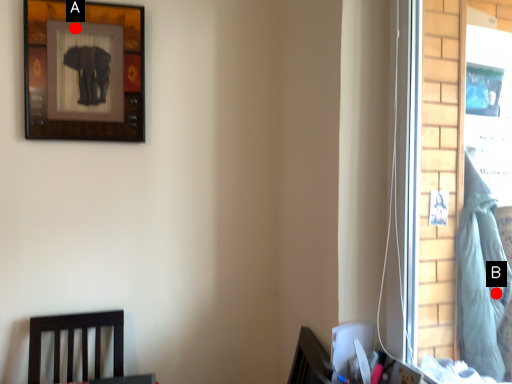
Question: Two points are circled on the image, labeled by A and B beside each circle. Which of the following is the closest to the observer?

Choices:
 (A) A is closer
 (B) B is closer

Answer: (B)